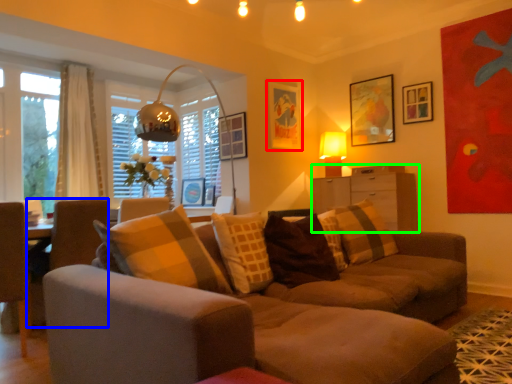
Question: Which object is positioned farthest from picture frame (highlighted by a red box)? Select from swivel chair (highlighted by a blue box) and dresser (highlighted by a green box).

Choices:
 (A) swivel chair
 (B) dresser

Answer: (A)